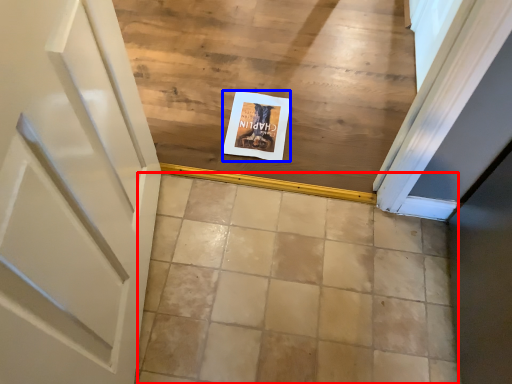
Question: Which object is closer to the camera taking this photo, ceramic tile (highlighted by a red box) or postcard (highlighted by a blue box)?

Choices:
 (A) ceramic tile
 (B) postcard

Answer: (A)